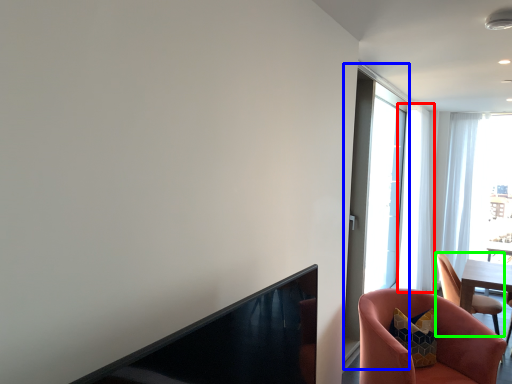
Question: Based on their relative distances, which object is farther from curtain (highlighted by a red box)? Choose from screen door (highlighted by a blue box) and chair (highlighted by a green box).

Choices:
 (A) screen door
 (B) chair

Answer: (B)